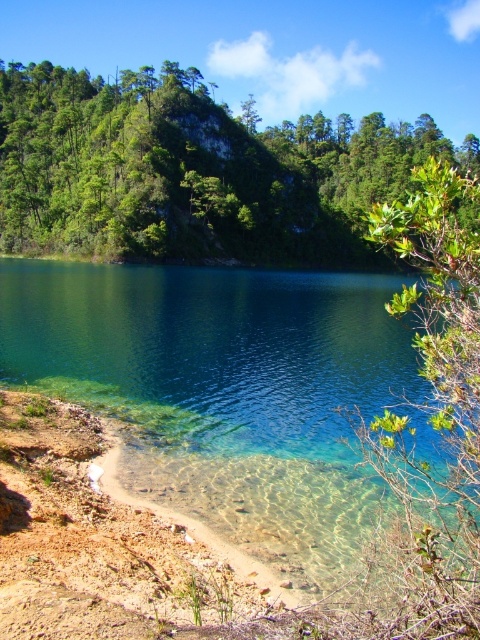
Who is taller, green leafy trees at upper center or clear glass lake at lower left?

green leafy trees at upper center is taller.

Is green leafy trees at upper center wider than clear glass lake at lower left?

Correct, the width of green leafy trees at upper center exceeds that of clear glass lake at lower left.

The height and width of the screenshot is (640, 480). What do you see at coordinates (192, 172) in the screenshot?
I see `green leafy trees at upper center` at bounding box center [192, 172].

The height and width of the screenshot is (640, 480). Identify the location of green leafy trees at upper center. (192, 172).